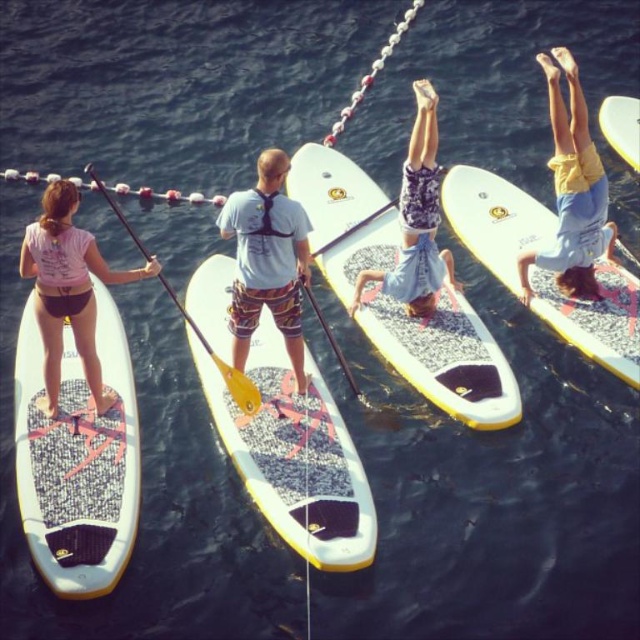
Is matte gray paddleboard at center wider than patterned fabric shorts at center?

In fact, matte gray paddleboard at center might be narrower than patterned fabric shorts at center.

Does point (285, 166) come behind point (406, 257)?

No, it is in front of (406, 257).

This screenshot has height=640, width=640. Identify the location of matte gray paddleboard at center. (268, 260).

Does white speckled surfboard at upper right come in front of matte gray paddleboard at center?

No.

Where is `white speckled surfboard at upper right`? This screenshot has height=640, width=640. white speckled surfboard at upper right is located at coordinates (493, 220).

Who is lower down, white textured surfboard at center or yellow fabric shorts at upper right?

white textured surfboard at center is below.

Which is more to the right, white textured surfboard at center or yellow fabric shorts at upper right?

From the viewer's perspective, yellow fabric shorts at upper right appears more on the right side.

This screenshot has height=640, width=640. In order to click on white textured surfboard at center in this screenshot , I will do `click(444, 356)`.